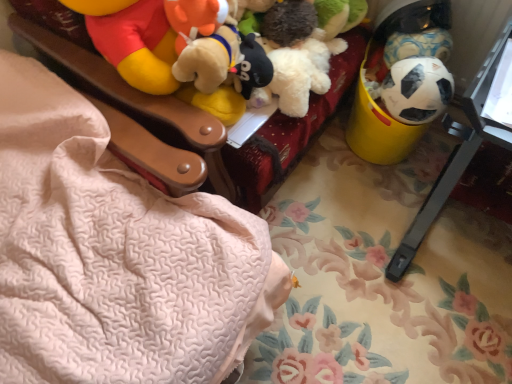
The image size is (512, 384). Describe the element at coordinates (415, 90) in the screenshot. I see `black matte soccer ball at right, the 1th toy positioned from the bottom` at that location.

What do you see at coordinates (466, 144) in the screenshot?
I see `yellow plastic changing table at right` at bounding box center [466, 144].

Locate an element on the screen. Image resolution: width=512 pixels, height=384 pixels. pink textured blanket at upper left is located at coordinates (x=111, y=254).

You are a GUI agent. You are given a task and a screenshot of the screen. Output one action in this format:
    pyautogui.click(x=<x>, y=<y>)
    Task: Click on the white matte soccer ball at right, placed as the second toy when sorted from bottom to top
    This screenshot has width=512, height=384.
    Given the screenshot: What is the action you would take?
    pyautogui.click(x=404, y=28)

Looking at this image, how many degrees apart are the facing directions of black matte soccer ball at right, arranged as the second toy when viewed from the top, and pink textured blanket at upper left?

They differ by 85.9 degrees in their facing directions.

From the image's perspective, is black matte soccer ball at right, arranged as the second toy when viewed from the top, positioned above or below pink textured blanket at upper left?

black matte soccer ball at right, arranged as the second toy when viewed from the top, is situated higher than pink textured blanket at upper left in the image.

This screenshot has width=512, height=384. What are the coordinates of `blanket below the black matte soccer ball at right, arranged as the second toy when viewed from the top (from a real-world perspective)` in the screenshot? It's located at (111, 254).

Which object is positioned more to the right, black matte soccer ball at right, the 1th toy positioned from the bottom, or pink textured blanket at upper left?

Positioned to the right is black matte soccer ball at right, the 1th toy positioned from the bottom.

From a real-world perspective, is yellow plastic changing table at right physically located above or below pink textured blanket at upper left?

From a real-world perspective, yellow plastic changing table at right is physically above pink textured blanket at upper left.

Considering the positions of objects yellow plastic changing table at right and pink textured blanket at upper left in the image provided, who is more to the left, yellow plastic changing table at right or pink textured blanket at upper left?

Positioned to the left is pink textured blanket at upper left.

From the image's perspective, does yellow plastic changing table at right appear higher than pink textured blanket at upper left?

Yes, from the image's perspective, yellow plastic changing table at right is above pink textured blanket at upper left.

Which object is wider, yellow plastic changing table at right or pink textured blanket at upper left?

With larger width is pink textured blanket at upper left.

Considering the relative positions of yellow plastic bucket at right and black matte soccer ball at right, the 1th toy positioned from the bottom, in the image provided, is yellow plastic bucket at right to the left or to the right of black matte soccer ball at right, the 1th toy positioned from the bottom,?

yellow plastic bucket at right is to the left of black matte soccer ball at right, the 1th toy positioned from the bottom.

Considering the relative positions of yellow plastic bucket at right and black matte soccer ball at right, the 1th toy positioned from the bottom, in the image provided, is yellow plastic bucket at right behind black matte soccer ball at right, the 1th toy positioned from the bottom,?

That is False.

Is yellow plastic bucket at right facing away from black matte soccer ball at right, arranged as the second toy when viewed from the top?

yellow plastic bucket at right does not have its back to black matte soccer ball at right, arranged as the second toy when viewed from the top.

Which of these two, yellow plastic bucket at right or black matte soccer ball at right, the 1th toy positioned from the bottom, stands taller?

yellow plastic bucket at right is taller.

Looking at their sizes, would you say black matte soccer ball at right, arranged as the second toy when viewed from the top, is wider or thinner than yellow plastic bucket at right?

Considering their sizes, black matte soccer ball at right, arranged as the second toy when viewed from the top, looks slimmer than yellow plastic bucket at right.

Locate an element on the screen. furniture above the black matte soccer ball at right, arranged as the second toy when viewed from the top (from the image's perspective) is located at coordinates (291, 131).

What's the angular difference between black matte soccer ball at right, arranged as the second toy when viewed from the top, and yellow plastic bucket at right's facing directions?

85.9 degrees.

Is black matte soccer ball at right, arranged as the second toy when viewed from the top, oriented away from yellow plastic bucket at right?

That's not correct — black matte soccer ball at right, arranged as the second toy when viewed from the top, is not looking away from yellow plastic bucket at right.

Which of these two, yellow plastic changing table at right or yellow plastic bucket at right, is wider?

With larger width is yellow plastic bucket at right.

Which is correct: yellow plastic changing table at right is inside yellow plastic bucket at right, or outside of it?

yellow plastic changing table at right lies outside yellow plastic bucket at right.

Looking at this image, from a real-world perspective, is yellow plastic changing table at right physically located above or below yellow plastic bucket at right?

Clearly, from a real-world perspective, yellow plastic changing table at right is below yellow plastic bucket at right.

Between point (448, 176) and point (244, 165), which one is positioned in front?

The point (244, 165) is more forward.

Is yellow plastic bucket at right to the right of pink textured blanket at upper left from the viewer's perspective?

Indeed, yellow plastic bucket at right is positioned on the right side of pink textured blanket at upper left.

From the image's perspective, is yellow plastic bucket at right beneath pink textured blanket at upper left?

No.

Between yellow plastic bucket at right and pink textured blanket at upper left, which one has smaller size?

yellow plastic bucket at right.

Can you confirm if yellow plastic bucket at right is wider than pink textured blanket at upper left?

In fact, yellow plastic bucket at right might be narrower than pink textured blanket at upper left.

From the picture: From the image's perspective, would you say white matte soccer ball at right, placed as the second toy when sorted from bottom to top, is shown under black matte soccer ball at right, the 1th toy positioned from the bottom?

No, from the image's perspective, white matte soccer ball at right, placed as the second toy when sorted from bottom to top, is not below black matte soccer ball at right, the 1th toy positioned from the bottom.

From a real-world perspective, is white matte soccer ball at right, placed as the second toy when sorted from bottom to top, physically below black matte soccer ball at right, arranged as the second toy when viewed from the top?

Actually, white matte soccer ball at right, placed as the second toy when sorted from bottom to top, is physically above black matte soccer ball at right, arranged as the second toy when viewed from the top, in the real world.

Where is `toy in front of the white matte soccer ball at right, which is the first toy in top-to-bottom order`? toy in front of the white matte soccer ball at right, which is the first toy in top-to-bottom order is located at coordinates (415, 90).

Find the location of a particular element. The image size is (512, 384). the 1st toy behind when counting from the pink textured blanket at upper left is located at coordinates (415, 90).

Locate an element on the screen. The width and height of the screenshot is (512, 384). changing table above the pink textured blanket at upper left (from a real-world perspective) is located at coordinates (466, 144).

Based on their spatial positions, is pink textured blanket at upper left or white matte soccer ball at right, placed as the second toy when sorted from bottom to top, further from black matte soccer ball at right, the 1th toy positioned from the bottom?

pink textured blanket at upper left is further to black matte soccer ball at right, the 1th toy positioned from the bottom.

From the image, which object appears to be nearer to pink textured blanket at upper left, white matte soccer ball at right, placed as the second toy when sorted from bottom to top, or yellow plastic changing table at right?

yellow plastic changing table at right is positioned closer to the anchor pink textured blanket at upper left.

From the image, which object appears to be farther from yellow plastic bucket at right, white matte soccer ball at right, placed as the second toy when sorted from bottom to top, or black matte soccer ball at right, the 1th toy positioned from the bottom?

Based on the image, black matte soccer ball at right, the 1th toy positioned from the bottom, appears to be further to yellow plastic bucket at right.

Which object lies further to the anchor point yellow plastic changing table at right, pink textured blanket at upper left or yellow plastic bucket at right?

pink textured blanket at upper left.

Considering their positions, is yellow plastic changing table at right positioned further to yellow plastic bucket at right than pink textured blanket at upper left?

yellow plastic changing table at right is positioned further to the anchor yellow plastic bucket at right.

Looking at this image, estimate the real-world distances between objects in this image. Which object is further from pink textured blanket at upper left, yellow plastic changing table at right or black matte soccer ball at right, arranged as the second toy when viewed from the top?

Among the two, yellow plastic changing table at right is located further to pink textured blanket at upper left.

From the picture: From the image, which object appears to be farther from yellow plastic changing table at right, yellow plastic bucket at right or white matte soccer ball at right, placed as the second toy when sorted from bottom to top?

Based on the image, yellow plastic bucket at right appears to be further to yellow plastic changing table at right.

Based on the photo, considering their positions, is white matte soccer ball at right, placed as the second toy when sorted from bottom to top, positioned further to pink textured blanket at upper left than yellow plastic bucket at right?

white matte soccer ball at right, placed as the second toy when sorted from bottom to top, is positioned further to the anchor pink textured blanket at upper left.

Locate an element on the screen. The image size is (512, 384). furniture located between pink textured blanket at upper left and white matte soccer ball at right, which is the first toy in top-to-bottom order, in the left-right direction is located at coordinates (291, 131).

The image size is (512, 384). Identify the location of furniture between pink textured blanket at upper left and yellow plastic changing table at right in the horizontal direction. (291, 131).

Locate an element on the screen. The width and height of the screenshot is (512, 384). furniture located between pink textured blanket at upper left and black matte soccer ball at right, arranged as the second toy when viewed from the top, in the left-right direction is located at coordinates (291, 131).

Locate an element on the screen. The image size is (512, 384). toy positioned between yellow plastic changing table at right and white matte soccer ball at right, which is the first toy in top-to-bottom order, from near to far is located at coordinates (415, 90).